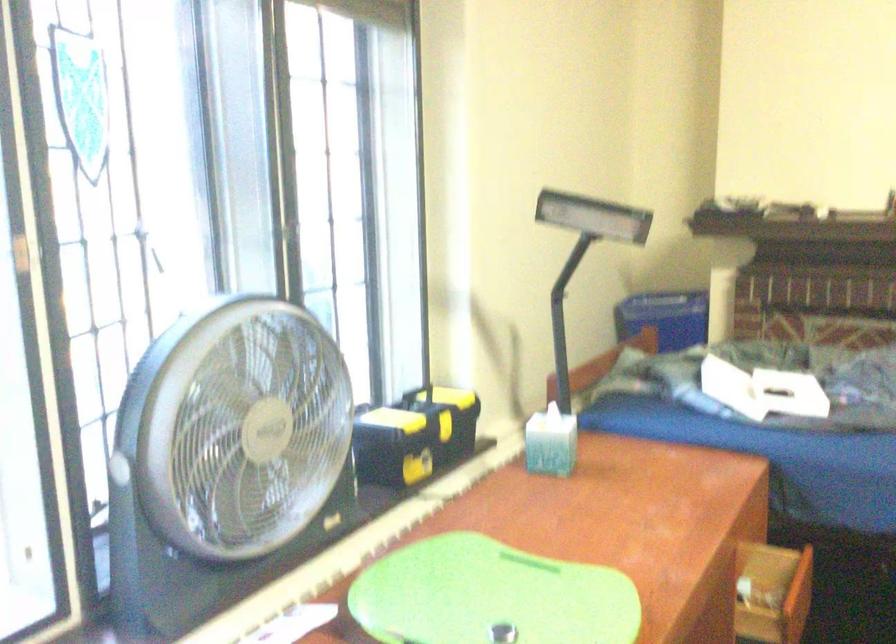
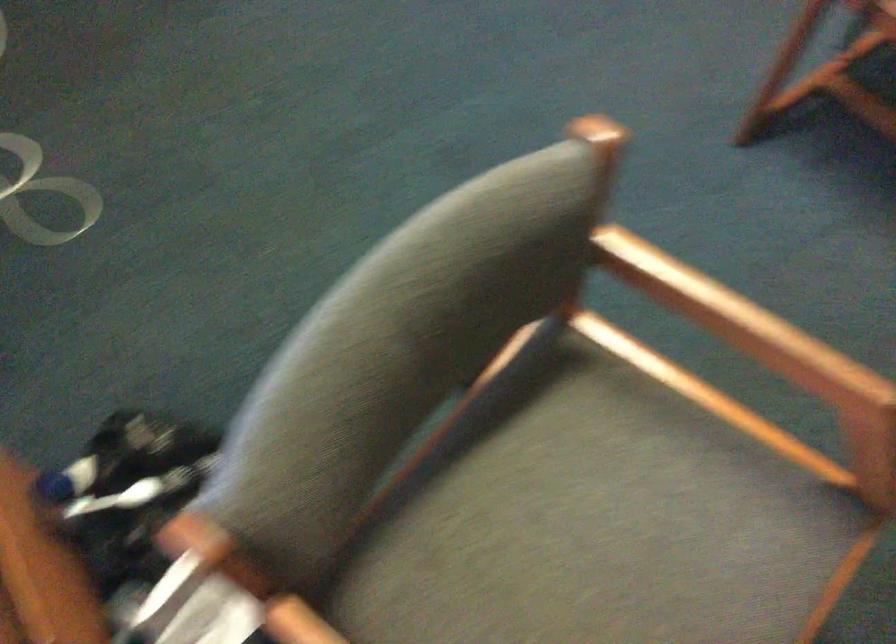
Based on the continuous images, in which direction is the camera rotating?

The camera's rotation is toward right-down.